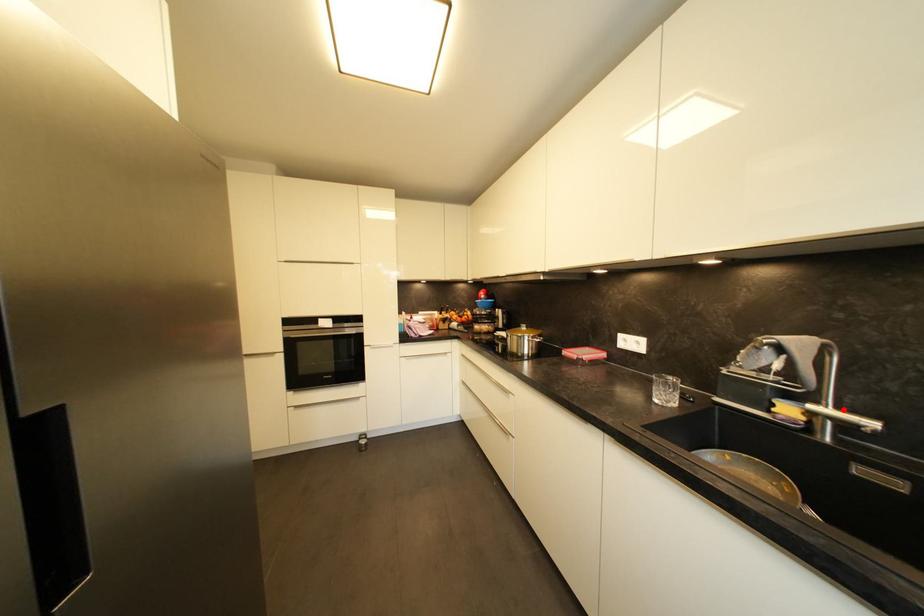
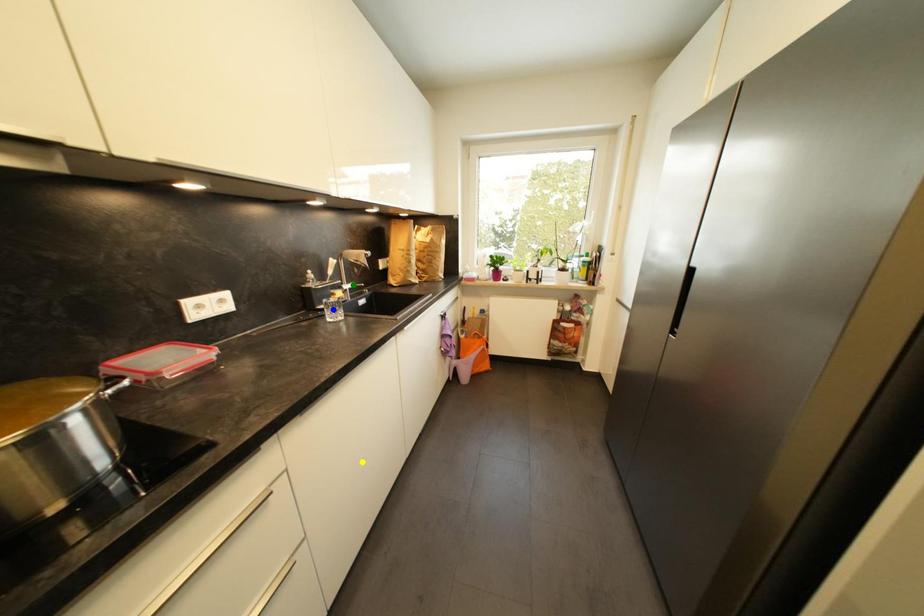
Question: I am providing you with two images of the same scene from different viewpoints. A red point is marked on the first image. You are given multiple points on the second image. In image 2, which mark is for the same physical point as the one in image 1?

Choices:
 (A) green point
 (B) blue point
 (C) yellow point

Answer: (A)